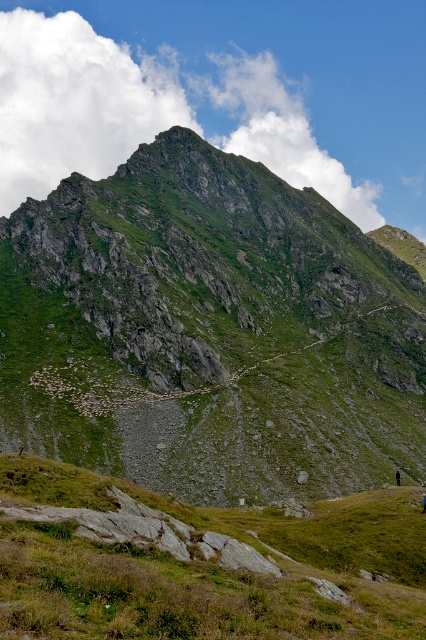
Question: Which object appears closest to the camera in this image?

Choices:
 (A) green grassy at lower center
 (B) green rocky mountain at center

Answer: (A)

Question: Is green rocky mountain at center closer to the viewer compared to green grassy at lower center?

Choices:
 (A) yes
 (B) no

Answer: (B)

Question: Does green rocky mountain at center have a greater width compared to green grassy at lower center?

Choices:
 (A) no
 (B) yes

Answer: (B)

Question: Considering the relative positions of green rocky mountain at center and green grassy at lower center in the image provided, where is green rocky mountain at center located with respect to green grassy at lower center?

Choices:
 (A) right
 (B) left

Answer: (A)

Question: Which point is farther to the camera?

Choices:
 (A) (359, 612)
 (B) (49, 344)

Answer: (B)

Question: Which of the following is the closest to the observer?

Choices:
 (A) green grassy at lower center
 (B) green rocky mountain at center

Answer: (A)